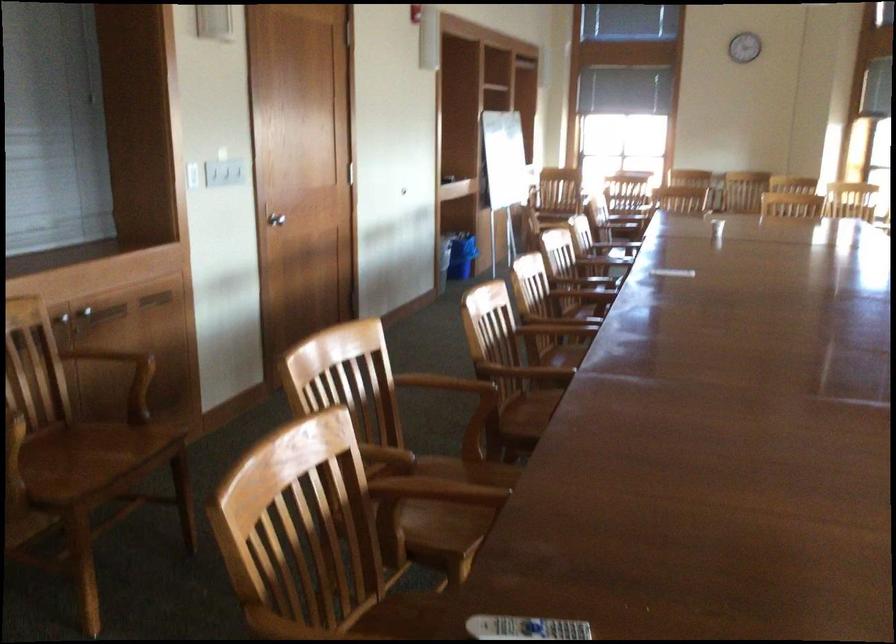
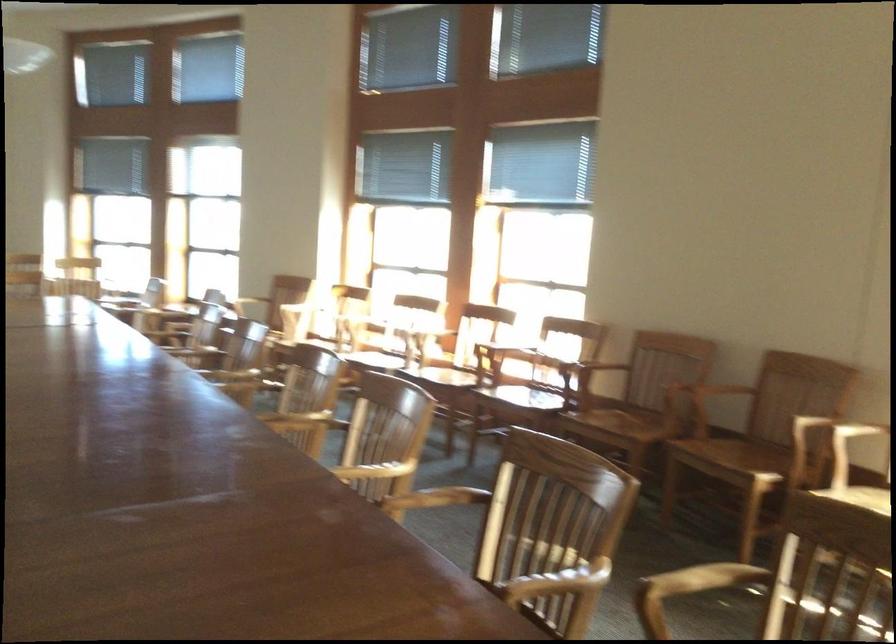
Question: The images are taken continuously from a first-person perspective. In which direction is your viewpoint rotating?

Choices:
 (A) Left
 (B) Right
 (C) Up
 (D) Down

Answer: (B)